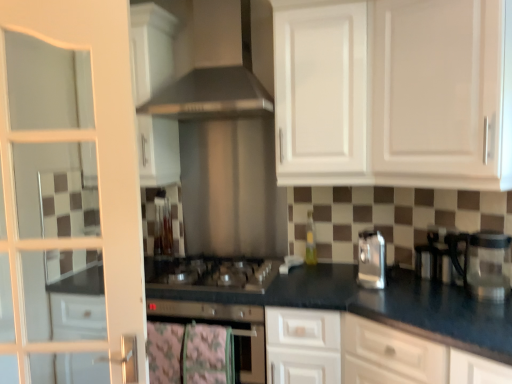
Question: From a real-world perspective, is satin silver gas stove at center physically located above or below white glass door at left?

Choices:
 (A) below
 (B) above

Answer: (A)

Question: Considering the positions of satin silver gas stove at center and white glass door at left in the image, is satin silver gas stove at center bigger or smaller than white glass door at left?

Choices:
 (A) small
 (B) big

Answer: (A)

Question: Which of these objects is positioned farthest from the transparent glass coffee machine at right?

Choices:
 (A) black granite countertop at center
 (B) satin silver oven at center
 (C) white glossy cabinet at upper center, marked as the 2th cabinetry in a back-to-front arrangement
 (D) white glass door at left
 (E) satin silver gas stove at center

Answer: (D)

Question: Estimate the real-world distances between objects in this image. Which object is closer to the white glass door at left?

Choices:
 (A) transparent glass coffee machine at right
 (B) satin silver oven at center
 (C) black granite countertop at center
 (D) white glossy cabinet at upper center, marked as the 2th cabinetry in a back-to-front arrangement
 (E) stainless steel exhaust hood at upper center

Answer: (E)